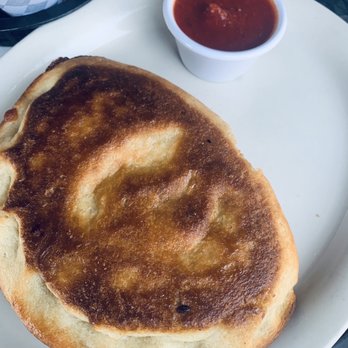
Where is `white plate`? The height and width of the screenshot is (348, 348). white plate is located at coordinates (8, 335), (322, 313), (134, 35), (315, 23).